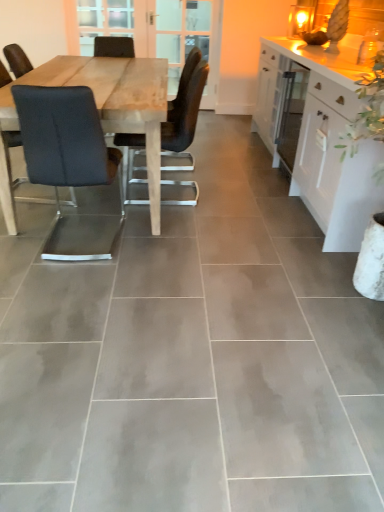
The image size is (384, 512). I want to click on free location in front of black fabric chair at left, which is the first chair from left to right, so click(x=77, y=284).